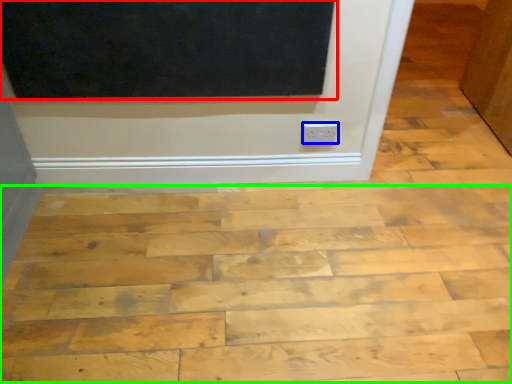
Question: Estimate the real-world distances between objects in this image. Which object is closer to screen door (highlighted by a red box), electric outlet (highlighted by a blue box) or plywood (highlighted by a green box)?

Choices:
 (A) electric outlet
 (B) plywood

Answer: (A)